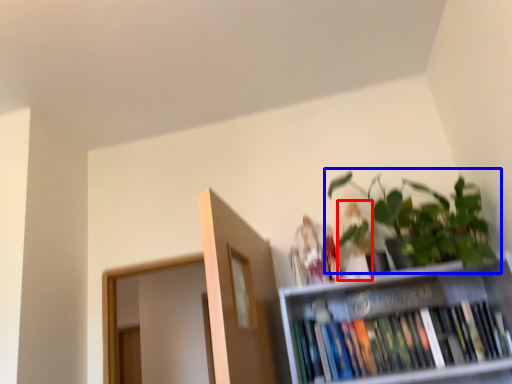
Question: Which point is further to the camera, toy (highlighted by a red box) or houseplant (highlighted by a blue box)?

Choices:
 (A) toy
 (B) houseplant

Answer: (A)